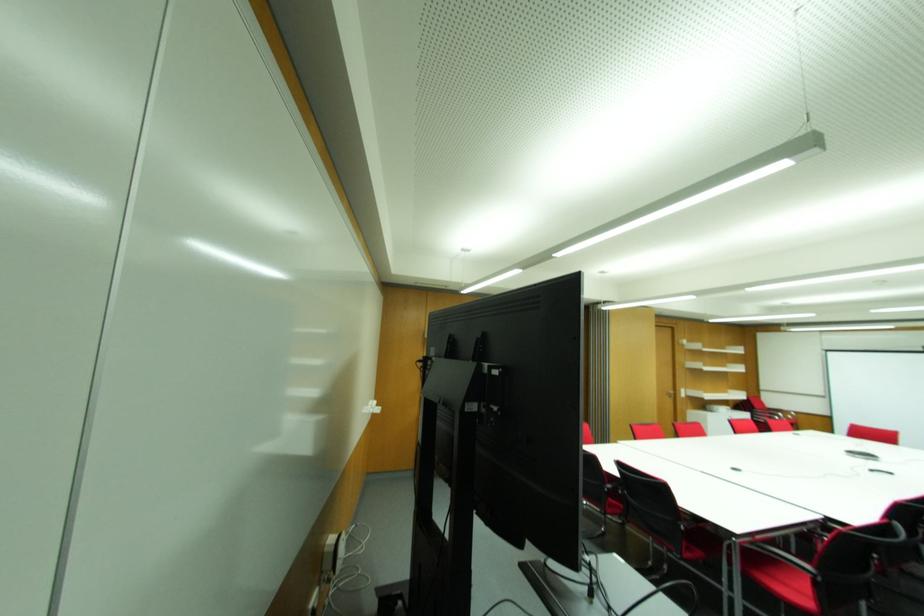
Locate an element on the screen. Image resolution: width=924 pixels, height=616 pixels. red chair sitting surface is located at coordinates (782, 570).